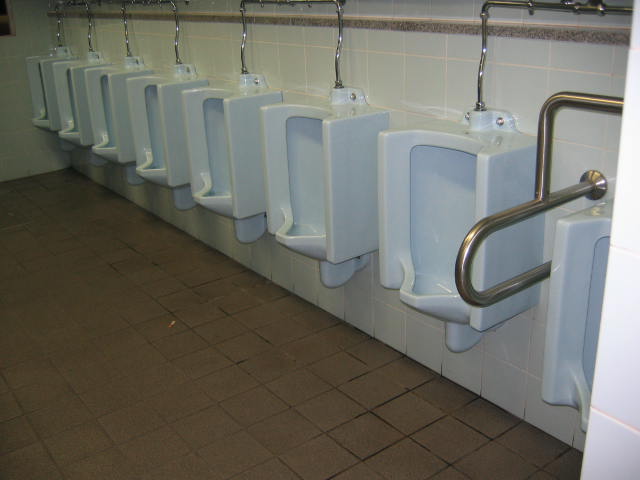
Image resolution: width=640 pixels, height=480 pixels. Find the location of `urinal`. urinal is located at coordinates (580, 277), (445, 221), (323, 180), (211, 143), (160, 137), (109, 123), (70, 106), (45, 98).